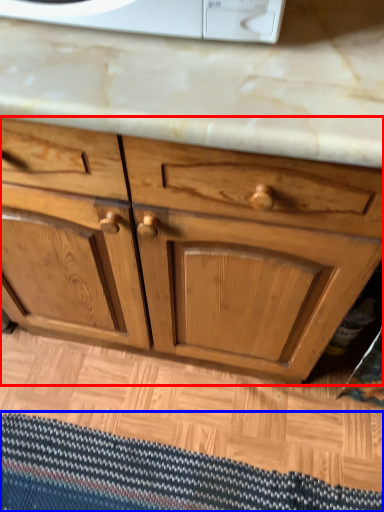
Question: Which object is closer to the camera taking this photo, chest of drawers (highlighted by a red box) or doormat (highlighted by a blue box)?

Choices:
 (A) chest of drawers
 (B) doormat

Answer: (A)